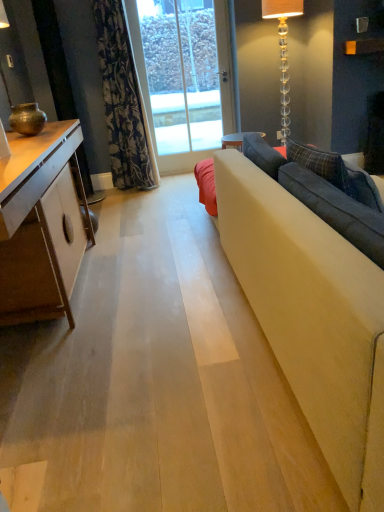
Locate an element on the screen. The width and height of the screenshot is (384, 512). free spot to the right of white glossy cabinet at left is located at coordinates (158, 276).